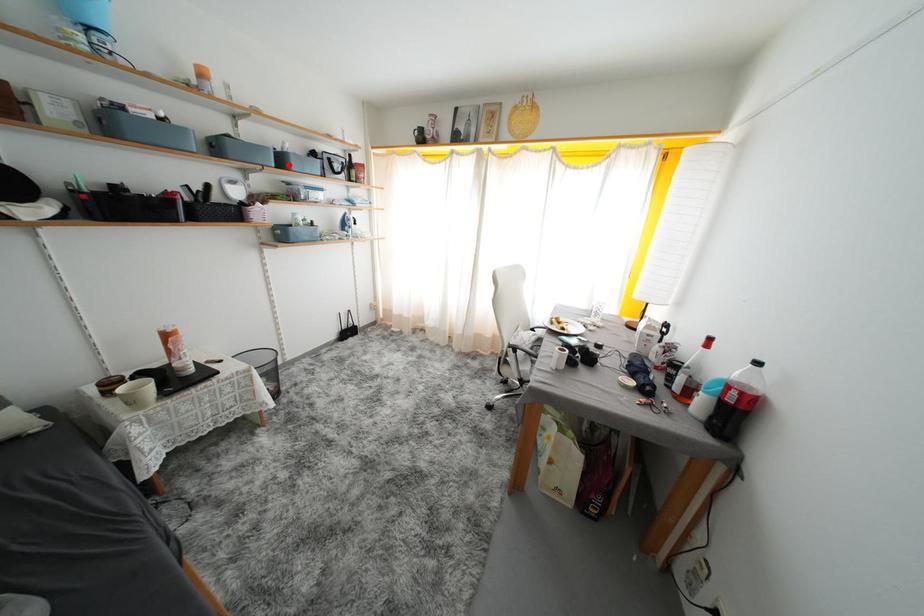
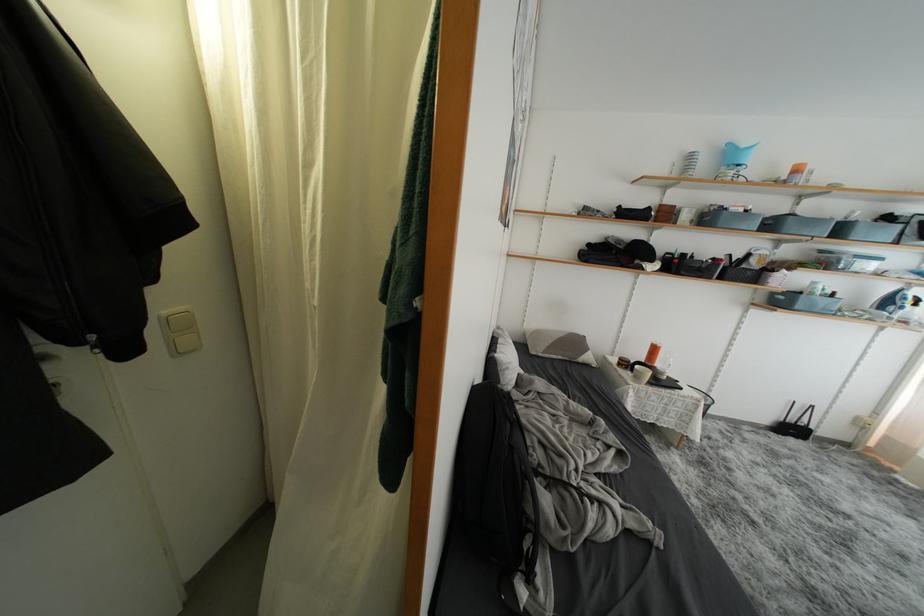
Question: A red point is marked in image1. In image2, is the corresponding 3D point closer to the camera or farther? Reply with the corresponding letter.

Choices:
 (A) The corresponding 3D point is closer.
 (B) The corresponding 3D point is farther.

Answer: (B)